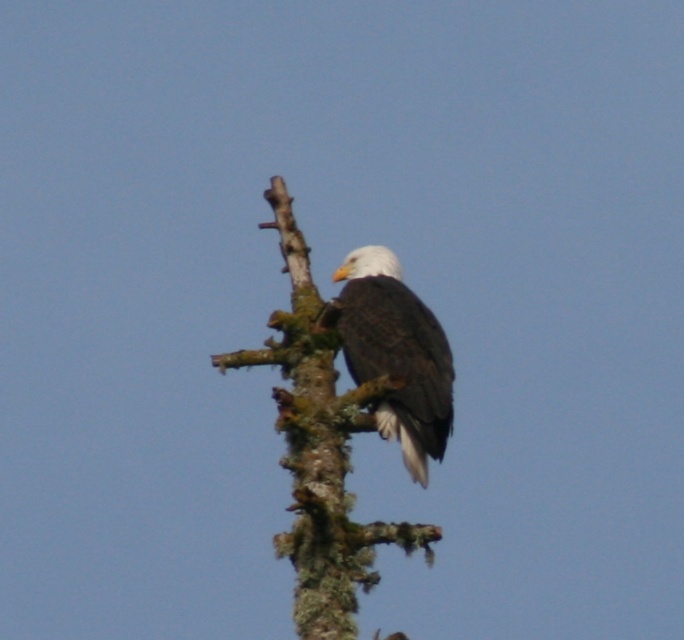
Question: Does green mossy branch at upper center lie behind white-feathered bald eagle at center?

Choices:
 (A) no
 (B) yes

Answer: (A)

Question: Which of the following is the closest to the observer?

Choices:
 (A) [321, 394]
 (B) [343, 337]

Answer: (A)

Question: Can you confirm if green mossy branch at upper center is thinner than white-feathered bald eagle at center?

Choices:
 (A) no
 (B) yes

Answer: (B)

Question: Which point appears closest to the camera in this image?

Choices:
 (A) (356, 356)
 (B) (295, 477)

Answer: (B)

Question: Does green mossy branch at upper center have a larger size compared to white-feathered bald eagle at center?

Choices:
 (A) yes
 (B) no

Answer: (B)